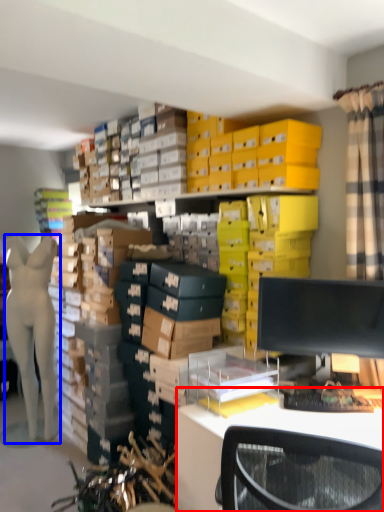
Question: Which object is closer to the camera taking this photo, desk (highlighted by a red box) or person (highlighted by a blue box)?

Choices:
 (A) desk
 (B) person

Answer: (A)